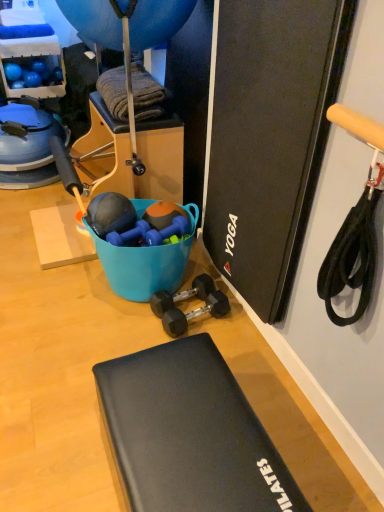
Question: From a real-world perspective, is black rubber dumbbell at center, which is counted as the 1th dumbbell, starting from the bottom, located higher than blue rubber dumbbell at center, placed as the first dumbbell when sorted from top to bottom?

Choices:
 (A) no
 (B) yes

Answer: (A)

Question: Is black rubber dumbbell at center, which is counted as the 1th dumbbell, starting from the bottom, oriented towards blue rubber dumbbell at center, placed as the 3th dumbbell when sorted from bottom to top?

Choices:
 (A) no
 (B) yes

Answer: (A)

Question: Is black rubber dumbbell at center, which is counted as the 1th dumbbell, starting from the bottom, bigger than blue rubber dumbbell at center, placed as the 3th dumbbell when sorted from bottom to top?

Choices:
 (A) no
 (B) yes

Answer: (B)

Question: From the image's perspective, is black rubber dumbbell at center, which is counted as the 1th dumbbell, starting from the bottom, under blue rubber dumbbell at center, placed as the 3th dumbbell when sorted from bottom to top?

Choices:
 (A) yes
 (B) no

Answer: (A)

Question: Are black rubber dumbbell at center, marked as the third dumbbell in a top-to-bottom arrangement, and blue rubber dumbbell at center, placed as the 3th dumbbell when sorted from bottom to top, far apart?

Choices:
 (A) yes
 (B) no

Answer: (B)

Question: Does black rubber dumbbell at center, marked as the third dumbbell in a top-to-bottom arrangement, appear on the right side of blue rubber dumbbell at center, placed as the first dumbbell when sorted from top to bottom?

Choices:
 (A) yes
 (B) no

Answer: (A)

Question: Considering the relative sizes of black rubber dumbbells at center, which is the 2th dumbbell from bottom to top, and blue rubber dumbbell at center, placed as the 3th dumbbell when sorted from bottom to top, in the image provided, is black rubber dumbbells at center, which is the 2th dumbbell from bottom to top, smaller than blue rubber dumbbell at center, placed as the 3th dumbbell when sorted from bottom to top,?

Choices:
 (A) no
 (B) yes

Answer: (A)

Question: Does black rubber dumbbells at center, arranged as the 2th dumbbell when viewed from the top, have a greater width compared to blue rubber dumbbell at center, placed as the 3th dumbbell when sorted from bottom to top?

Choices:
 (A) no
 (B) yes

Answer: (B)

Question: Considering the relative positions of black rubber dumbbells at center, which is the 2th dumbbell from bottom to top, and blue rubber dumbbell at center, placed as the first dumbbell when sorted from top to bottom, in the image provided, is black rubber dumbbells at center, which is the 2th dumbbell from bottom to top, in front of blue rubber dumbbell at center, placed as the first dumbbell when sorted from top to bottom,?

Choices:
 (A) yes
 (B) no

Answer: (B)

Question: Is black rubber dumbbells at center, arranged as the 2th dumbbell when viewed from the top, to the right of blue rubber dumbbell at center, placed as the 3th dumbbell when sorted from bottom to top, from the viewer's perspective?

Choices:
 (A) no
 (B) yes

Answer: (B)

Question: Is black rubber dumbbells at center, which is the 2th dumbbell from bottom to top, positioned with its back to blue rubber dumbbell at center, placed as the 3th dumbbell when sorted from bottom to top?

Choices:
 (A) yes
 (B) no

Answer: (B)

Question: Is the depth of black rubber dumbbells at center, which is the 2th dumbbell from bottom to top, greater than that of blue rubber dumbbell at center, placed as the 3th dumbbell when sorted from bottom to top?

Choices:
 (A) yes
 (B) no

Answer: (A)

Question: Can you confirm if black rubber dumbbell at center, which is counted as the 1th dumbbell, starting from the bottom, is bigger than blue rubber balloon at upper center?

Choices:
 (A) yes
 (B) no

Answer: (B)